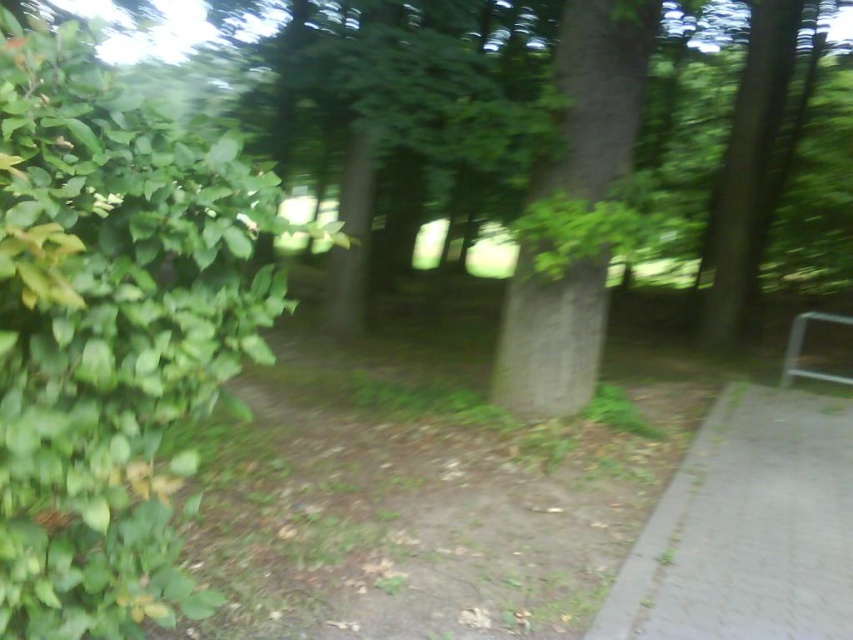
Does green leafy bush at left have a larger size compared to green rough bark tree at center?

Yes.

Is green leafy bush at left positioned behind green rough bark tree at center?

No.

Is point (102, 625) farther from viewer compared to point (503, 348)?

No, (102, 625) is closer to viewer.

What are the coordinates of `green leafy bush at left` in the screenshot? It's located at (111, 332).

Does gray concrete pavement at lower right appear over green rough bark tree at center?

No, gray concrete pavement at lower right is not above green rough bark tree at center.

Which of these two, gray concrete pavement at lower right or green rough bark tree at center, stands shorter?

gray concrete pavement at lower right

Between point (624, 630) and point (593, 132), which one is positioned behind?

Point (593, 132)

You are a GUI agent. You are given a task and a screenshot of the screen. Output one action in this format:
    pyautogui.click(x=<x>, y=<y>)
    Task: Click on the gray concrete pavement at lower right
    This screenshot has height=640, width=853.
    Given the screenshot: What is the action you would take?
    pyautogui.click(x=746, y=529)

Between green leafy bush at left and gray concrete pavement at lower right, which one has less height?

gray concrete pavement at lower right

The width and height of the screenshot is (853, 640). What are the coordinates of `green leafy bush at left` in the screenshot? It's located at (111, 332).